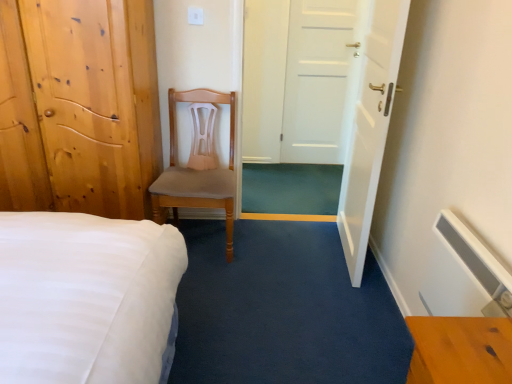
Identify the location of vacant region in front of white glossy door at center, the 3th door viewed from the left. (325, 278).